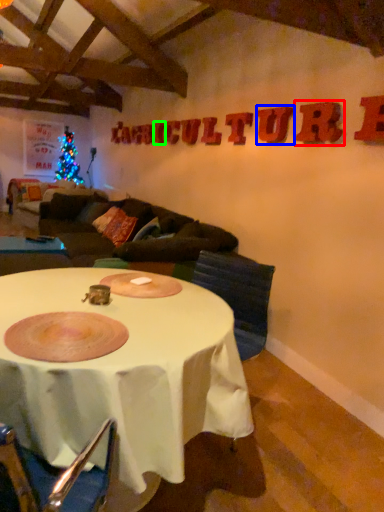
Question: Which object is the farthest from letter (highlighted by a red box)? Choose among these: letter (highlighted by a blue box) or letter (highlighted by a green box).

Choices:
 (A) letter
 (B) letter

Answer: (B)